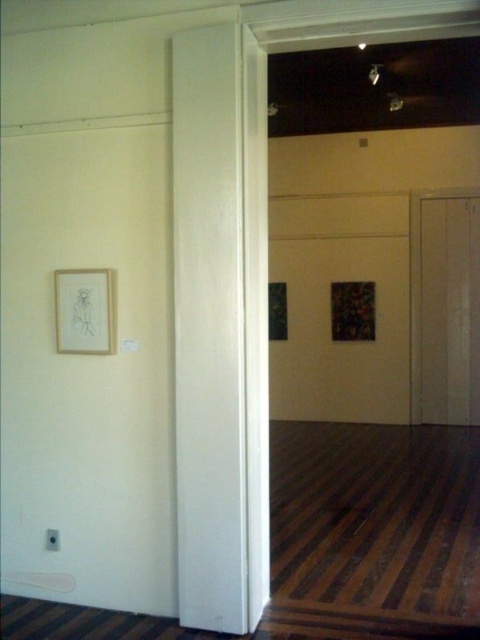
Question: Which object appears farthest from the camera in this image?

Choices:
 (A) matte wooden picture frame at left
 (B) white matte door at right
 (C) white glossy door at center

Answer: (B)

Question: Which of these objects is positioned closest to the white glossy door at center?

Choices:
 (A) white matte door at right
 (B) matte wooden picture frame at left

Answer: (B)

Question: Can you confirm if white matte door at right is positioned to the left of matte wooden picture frame at left?

Choices:
 (A) no
 (B) yes

Answer: (A)

Question: Observing the image, what is the correct spatial positioning of white glossy door at center in reference to white matte door at right?

Choices:
 (A) right
 (B) left

Answer: (B)

Question: Is white matte door at right to the left of matte wooden picture frame at left from the viewer's perspective?

Choices:
 (A) no
 (B) yes

Answer: (A)

Question: Which of the following is the farthest from the observer?

Choices:
 (A) white matte door at right
 (B) white glossy door at center

Answer: (A)